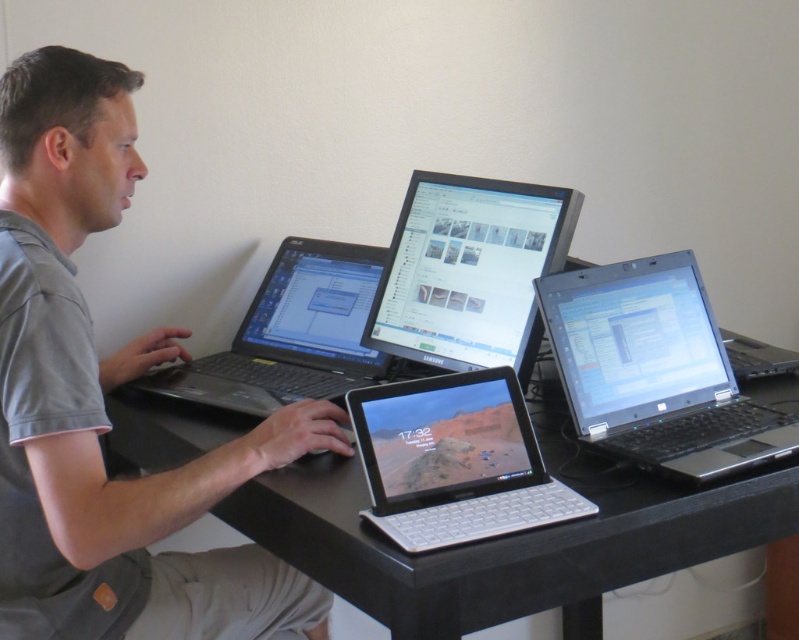
From the picture: Is gray fabric shirt at left smaller than satin black monitor at center?

No, gray fabric shirt at left is not smaller than satin black monitor at center.

Is gray fabric shirt at left shorter than satin black monitor at center?

In fact, gray fabric shirt at left may be taller than satin black monitor at center.

Describe the element at coordinates (102, 403) in the screenshot. I see `gray fabric shirt at left` at that location.

I want to click on gray fabric shirt at left, so click(102, 403).

Is black plastic table at center smaller than white plastic tablet at center?

Actually, black plastic table at center might be larger than white plastic tablet at center.

Which of these two, black plastic table at center or white plastic tablet at center, stands taller?

black plastic table at center is taller.

Who is more forward, [126,435] or [428,387]?

Point [428,387] is more forward.

The height and width of the screenshot is (640, 799). Find the location of `black plastic table at center`. black plastic table at center is located at coordinates (511, 538).

Can you confirm if satin black monitor at center is positioned above white plastic tablet at center?

Indeed, satin black monitor at center is positioned over white plastic tablet at center.

Is point (543, 268) farther from camera compared to point (398, 445)?

Yes, it is.

Find the location of a particular element. The image size is (799, 640). satin black monitor at center is located at coordinates (468, 272).